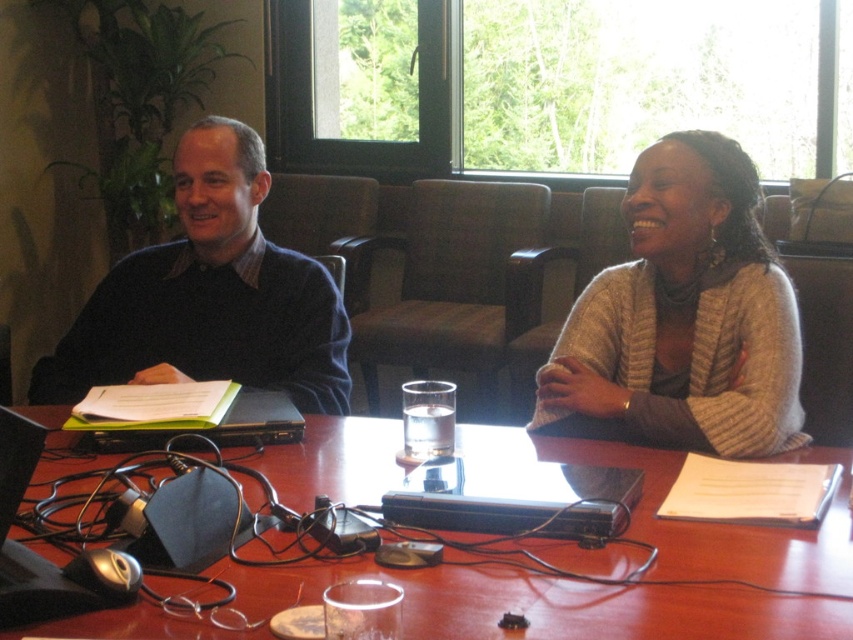
Is knitted beige sweater at center to the left of black plastic laptop at lower left from the viewer's perspective?

No, knitted beige sweater at center is not to the left of black plastic laptop at lower left.

Image resolution: width=853 pixels, height=640 pixels. What are the coordinates of `knitted beige sweater at center` in the screenshot? It's located at (683, 317).

Does wooden table at center appear on the left side of dark blue sweater at upper left?

Incorrect, wooden table at center is not on the left side of dark blue sweater at upper left.

Does wooden table at center lie behind dark blue sweater at upper left?

That is False.

Where is `wooden table at center`? Image resolution: width=853 pixels, height=640 pixels. wooden table at center is located at coordinates point(554,604).

Is wooden table at center closer to camera compared to knitted beige sweater at center?

Yes, it is.

Can you confirm if wooden table at center is thinner than knitted beige sweater at center?

In fact, wooden table at center might be wider than knitted beige sweater at center.

Locate an element on the screen. The height and width of the screenshot is (640, 853). wooden table at center is located at coordinates (554, 604).